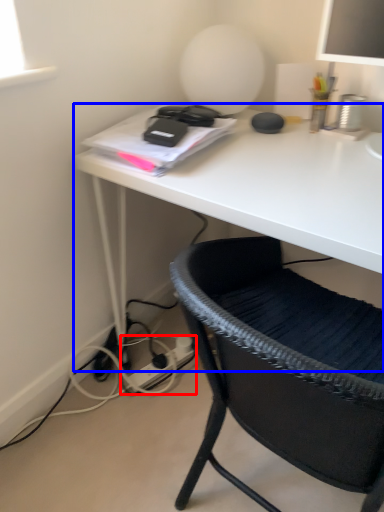
Question: Which object appears farthest to the camera in this image, plug (highlighted by a red box) or desk (highlighted by a blue box)?

Choices:
 (A) plug
 (B) desk

Answer: (A)